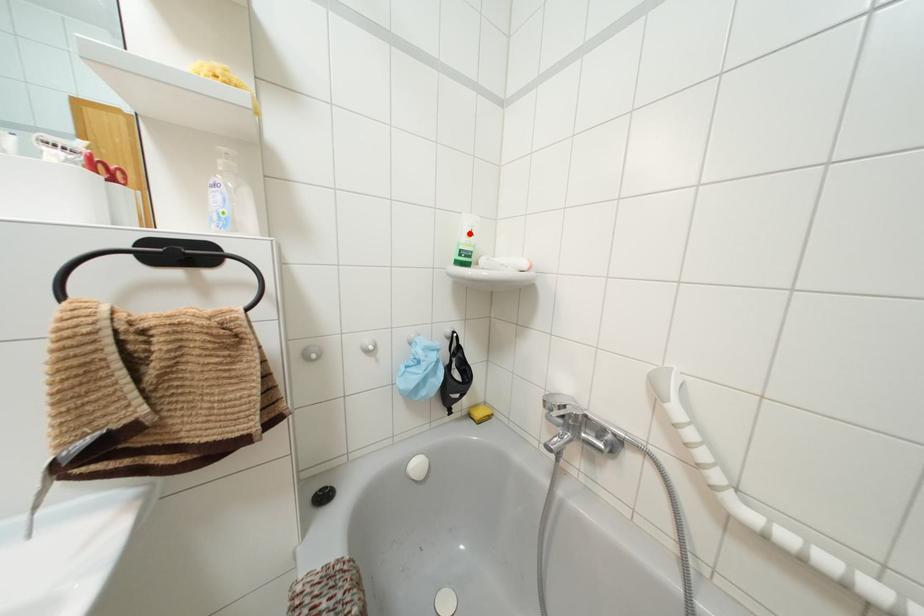
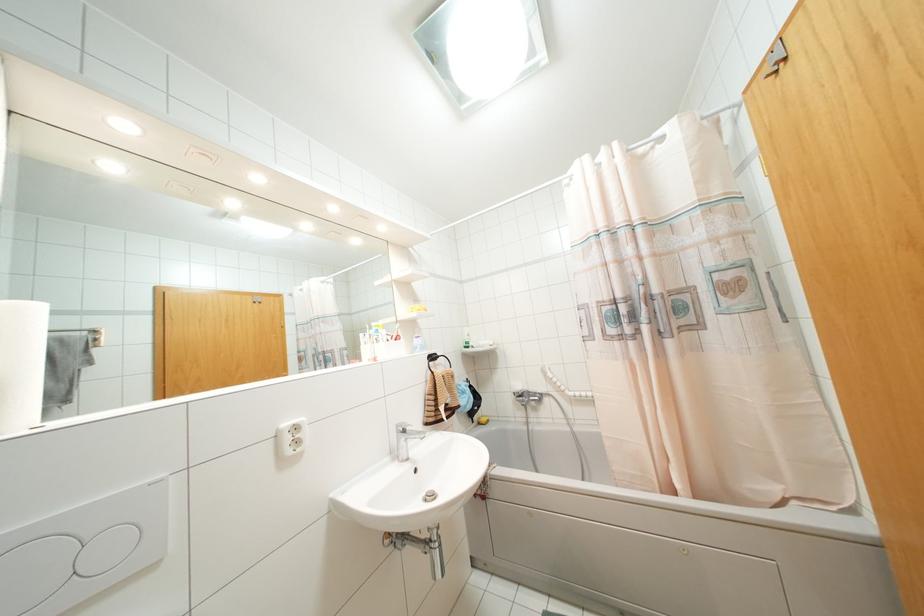
In the second image, find the point that corresponds to the highlighted location in the first image.

(468, 334)